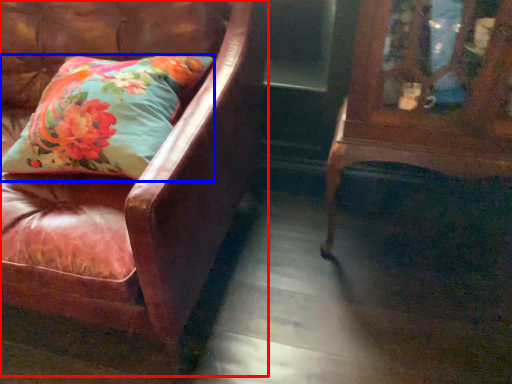
Question: Which object appears closest to the camera in this image, chair (highlighted by a red box) or pillow (highlighted by a blue box)?

Choices:
 (A) chair
 (B) pillow

Answer: (A)